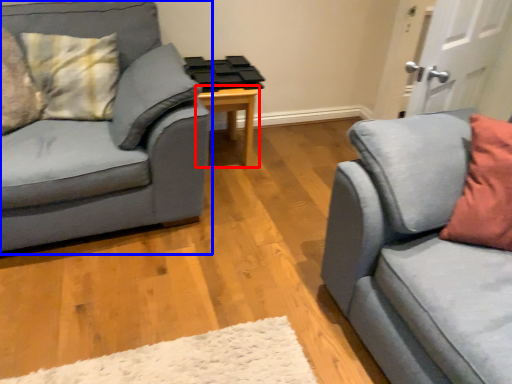
Question: Which object appears farthest to the camera in this image, table (highlighted by a red box) or studio couch (highlighted by a blue box)?

Choices:
 (A) table
 (B) studio couch

Answer: (A)